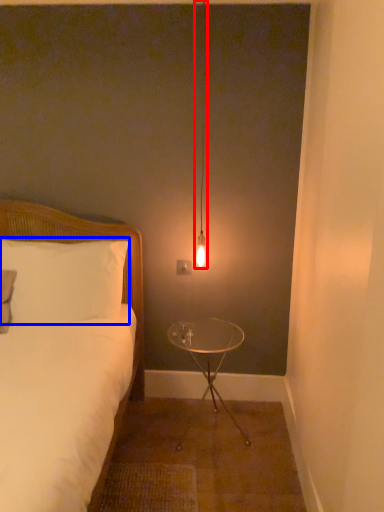
Question: Which of the following is the closest to the observer, lamp (highlighted by a red box) or pillow (highlighted by a blue box)?

Choices:
 (A) lamp
 (B) pillow

Answer: (A)